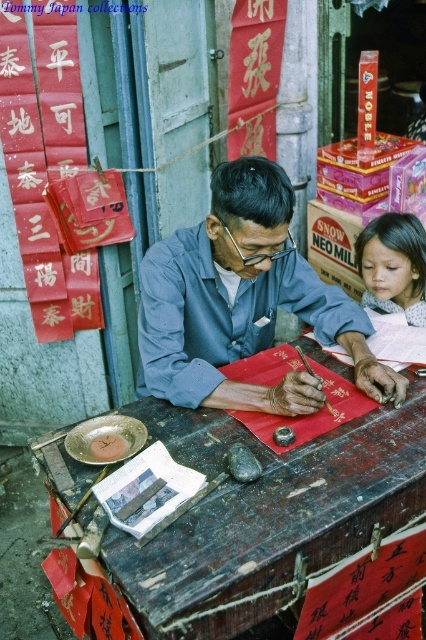
Between wooden table at center and blue fabric shirt at center, which one has more height?

Standing taller between the two is blue fabric shirt at center.

Can you confirm if wooden table at center is wider than blue fabric shirt at center?

Indeed, wooden table at center has a greater width compared to blue fabric shirt at center.

Is point (336, 442) in front of point (311, 396)?

Yes, it is.

The height and width of the screenshot is (640, 426). Find the location of `wooden table at center`. wooden table at center is located at coordinates (265, 516).

Is blue fabric shirt at center wider than smooth paper scroll at center?

Yes, blue fabric shirt at center is wider than smooth paper scroll at center.

Describe the element at coordinates (242, 301) in the screenshot. I see `blue fabric shirt at center` at that location.

Find the location of `blue fabric shirt at center`. blue fabric shirt at center is located at coordinates (242, 301).

In the scene shown: Does wooden table at center have a greater width compared to smooth paper scroll at center?

Yes, wooden table at center is wider than smooth paper scroll at center.

Which of these two, wooden table at center or smooth paper scroll at center, stands shorter?

With less height is smooth paper scroll at center.

Is point (414, 449) farther from viewer compared to point (36, 13)?

No, it is not.

The image size is (426, 640). I want to click on wooden table at center, so click(x=265, y=516).